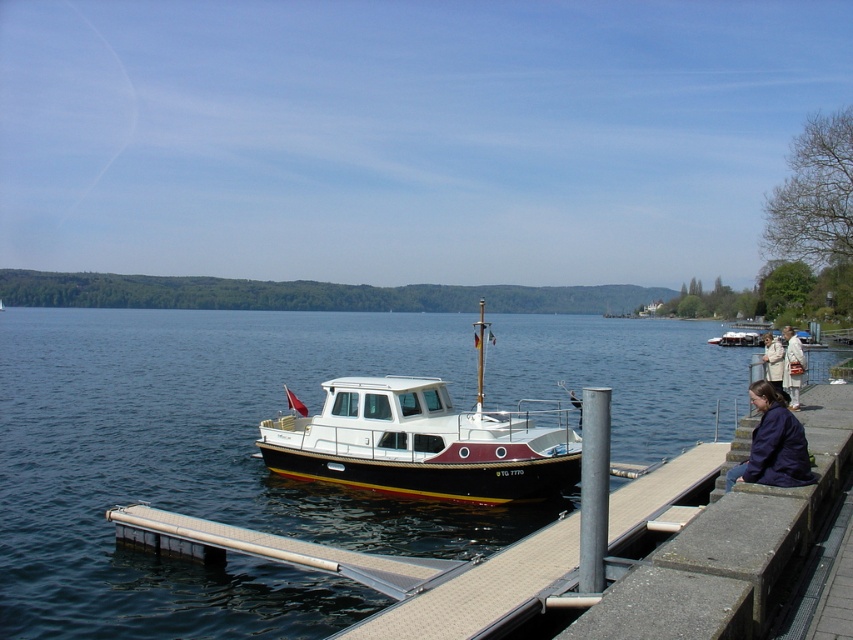
Does blue water at center appear under white wool coat at lower right?

No.

Does blue water at center have a greater height compared to white wool coat at lower right?

Yes.

Where is `blue water at center`? The image size is (853, 640). blue water at center is located at coordinates (202, 467).

Consider the image. Who is lower down, white glossy cabin cruiser at center or white fabric coat at right?

Positioned lower is white glossy cabin cruiser at center.

Identify the location of white glossy cabin cruiser at center. This screenshot has height=640, width=853. (421, 442).

Is point (756, 458) positioned before point (790, 392)?

That is True.

Who is positioned more to the left, dark blue jacket at lower right or white wool coat at lower right?

dark blue jacket at lower right is more to the left.

Describe the element at coordinates (773, 444) in the screenshot. I see `dark blue jacket at lower right` at that location.

The width and height of the screenshot is (853, 640). Find the location of `dark blue jacket at lower right`. dark blue jacket at lower right is located at coordinates (773, 444).